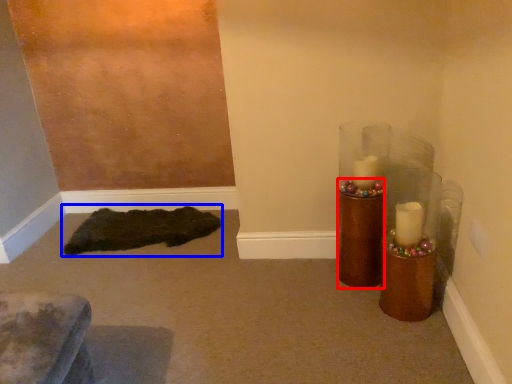
Question: Which of the following is the closest to the observer, candle holder (highlighted by a red box) or mat (highlighted by a blue box)?

Choices:
 (A) candle holder
 (B) mat

Answer: (A)